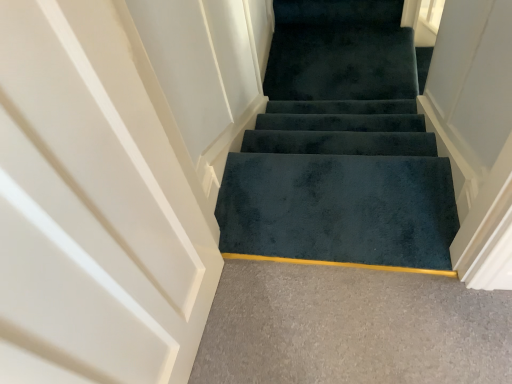
Question: Is dark blue carpet at center at the back of dark green carpet at center?

Choices:
 (A) no
 (B) yes

Answer: (B)

Question: From the image's perspective, is dark green carpet at center on dark blue carpet at center?

Choices:
 (A) no
 (B) yes

Answer: (A)

Question: Would you say dark green carpet at center contains dark blue carpet at center?

Choices:
 (A) yes
 (B) no

Answer: (B)

Question: Considering the relative sizes of dark green carpet at center and dark blue carpet at center in the image provided, is dark green carpet at center thinner than dark blue carpet at center?

Choices:
 (A) no
 (B) yes

Answer: (B)

Question: Can you confirm if dark green carpet at center is bigger than dark blue carpet at center?

Choices:
 (A) yes
 (B) no

Answer: (A)

Question: From a real-world perspective, is dark blue carpet at center physically located above or below dark green carpet at center?

Choices:
 (A) below
 (B) above

Answer: (A)

Question: In terms of width, does dark blue carpet at center look wider or thinner when compared to dark green carpet at center?

Choices:
 (A) wide
 (B) thin

Answer: (A)

Question: Is point (428, 155) closer or farther from the camera than point (355, 115)?

Choices:
 (A) farther
 (B) closer

Answer: (B)

Question: In the image, is dark blue carpet at center positioned in front of or behind dark green carpet at center?

Choices:
 (A) front
 (B) behind

Answer: (B)

Question: From the image's perspective, is dark blue carpet at center located above or below dark blue carpet at center?

Choices:
 (A) below
 (B) above

Answer: (A)

Question: In the image, is dark blue carpet at center positioned in front of or behind dark blue carpet at center?

Choices:
 (A) front
 (B) behind

Answer: (A)

Question: Is dark blue carpet at center situated inside dark blue carpet at center or outside?

Choices:
 (A) inside
 (B) outside

Answer: (B)

Question: In terms of width, does dark blue carpet at center look wider or thinner when compared to dark blue carpet at center?

Choices:
 (A) thin
 (B) wide

Answer: (B)

Question: From a real-world perspective, relative to dark green carpet at center, is dark blue carpet at center vertically above or below?

Choices:
 (A) above
 (B) below

Answer: (B)

Question: Do you think dark blue carpet at center is within dark green carpet at center, or outside of it?

Choices:
 (A) inside
 (B) outside

Answer: (B)